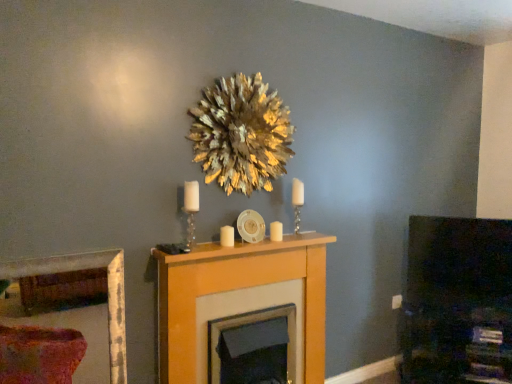
Measure the distance between point (248, 356) and camera.

The distance of point (248, 356) from camera is 7.21 feet.

The image size is (512, 384). Find the location of `wooden picture frame at lower left`. wooden picture frame at lower left is located at coordinates (75, 306).

Describe the element at coordinates (75, 306) in the screenshot. I see `wooden picture frame at lower left` at that location.

You are a GUI agent. You are given a task and a screenshot of the screen. Output one action in this format:
    pyautogui.click(x=<x>, y=<y>)
    Task: Click on the clear glass candle holder at center, acting as the second candle holder starting from the left
    
    Given the screenshot: What is the action you would take?
    pyautogui.click(x=297, y=202)

I want to click on gold leafy wreath at upper center, so click(241, 134).

From a real-world perspective, between white matte candle at center, the first candle in the left-to-right sequence, and clear glass candle holder at center, the 1th candle holder from the right, who is vertically higher?

clear glass candle holder at center, the 1th candle holder from the right, is physically above.

Who is shorter, white matte candle at center, the first candle in the left-to-right sequence, or clear glass candle holder at center, which is counted as the 2th candle holder, starting from the front?

With less height is white matte candle at center, the first candle in the left-to-right sequence.

Does white matte candle at center, the first candle from the front, lie in front of clear glass candle holder at center, which is counted as the 2th candle holder, starting from the front?

Yes, white matte candle at center, the first candle from the front, is closer to the camera.

Which of these two, white matte candle at center, the first candle from the front, or clear glass candle holder at center, acting as the second candle holder starting from the left, is bigger?

clear glass candle holder at center, acting as the second candle holder starting from the left, is bigger.

Can you tell me how much wooden mantel at center and wooden picture frame at lower left differ in facing direction?

They differ by 0.236 degrees in their facing directions.

Find the location of a particular element. Image resolution: width=512 pixels, height=384 pixels. picture frame above the wooden mantel at center (from a real-world perspective) is located at coordinates (75, 306).

From the image's perspective, is wooden mantel at center positioned above or below wooden picture frame at lower left?

Based on their image positions, wooden mantel at center is located beneath wooden picture frame at lower left.

Is wooden mantel at center positioned with its back to gold leafy wreath at upper center?

No, gold leafy wreath at upper center is not at the back of wooden mantel at center.

From the image's perspective, is wooden mantel at center located above or below gold leafy wreath at upper center?

wooden mantel at center is below gold leafy wreath at upper center.

Between wooden mantel at center and gold leafy wreath at upper center, which one appears on the right side from the viewer's perspective?

From the viewer's perspective, wooden mantel at center appears more on the right side.

Considering the positions of points (231, 284) and (250, 120), is point (231, 284) farther from camera compared to point (250, 120)?

That is False.

Between wooden mantel at center and clear glass candle holder at center, the 2th candle holder when ordered from right to left, which one appears on the right side from the viewer's perspective?

Positioned to the right is wooden mantel at center.

Do you think wooden mantel at center is within clear glass candle holder at center, the 2th candle holder when ordered from right to left, or outside of it?

wooden mantel at center cannot be found inside clear glass candle holder at center, the 2th candle holder when ordered from right to left.

From their relative heights in the image, would you say wooden mantel at center is taller or shorter than clear glass candle holder at center, placed as the second candle holder when sorted from back to front?

Clearly, wooden mantel at center is taller compared to clear glass candle holder at center, placed as the second candle holder when sorted from back to front.

Considering the positions of objects clear glass candle holder at center, which appears as the 1th candle holder when viewed from the front, and textured fabric swivel chair at lower left in the image provided, who is more to the left, clear glass candle holder at center, which appears as the 1th candle holder when viewed from the front, or textured fabric swivel chair at lower left?

Positioned to the left is textured fabric swivel chair at lower left.

Is clear glass candle holder at center, which appears as the 1th candle holder when viewed from the front, spatially inside textured fabric swivel chair at lower left, or outside of it?

The correct answer is: outside.

Would you say white matte candle at center, acting as the 2th candle starting from the right, is part of clear glass candle holder at center, marked as the 1th candle holder in a left-to-right arrangement,'s contents?

Definitely not — white matte candle at center, acting as the 2th candle starting from the right, is not inside clear glass candle holder at center, marked as the 1th candle holder in a left-to-right arrangement.

Between clear glass candle holder at center, the 2th candle holder when ordered from right to left, and white matte candle at center, which ranks as the 2th candle in back-to-front order, which one has more height?

With more height is clear glass candle holder at center, the 2th candle holder when ordered from right to left.

Which object is positioned more to the left, clear glass candle holder at center, marked as the 1th candle holder in a left-to-right arrangement, or white matte candle at center, the first candle from the front?

clear glass candle holder at center, marked as the 1th candle holder in a left-to-right arrangement.

From the image's perspective, relative to gold leafy wreath at upper center, is white glossy candle at center, which appears as the first candle when viewed from the right, above or below?

Based on their image positions, white glossy candle at center, which appears as the first candle when viewed from the right, is located beneath gold leafy wreath at upper center.

Which is more to the right, white glossy candle at center, the second candle when ordered from front to back, or gold leafy wreath at upper center?

Positioned to the right is white glossy candle at center, the second candle when ordered from front to back.

Considering the sizes of objects white glossy candle at center, the second candle when ordered from front to back, and gold leafy wreath at upper center in the image provided, who is shorter, white glossy candle at center, the second candle when ordered from front to back, or gold leafy wreath at upper center?

Standing shorter between the two is white glossy candle at center, the second candle when ordered from front to back.

Between white glossy candle at center, the second candle when ordered from front to back, and gold leafy wreath at upper center, which one has larger width?

gold leafy wreath at upper center.

Locate an element on the screen. The width and height of the screenshot is (512, 384). the 1st candle holder positioned above the white matte candle at center, the first candle in the left-to-right sequence (from a real-world perspective) is located at coordinates (297, 202).

Where is `picture frame that appears above the wooden mantel at center (from the image's perspective)`? The width and height of the screenshot is (512, 384). picture frame that appears above the wooden mantel at center (from the image's perspective) is located at coordinates (75, 306).

Estimate the real-world distances between objects in this image. Which object is further from clear glass candle holder at center, the 1th candle holder from the right, white glossy candle at center, which appears as the first candle when viewed from the right, or textured fabric swivel chair at lower left?

Based on the image, textured fabric swivel chair at lower left appears to be further to clear glass candle holder at center, the 1th candle holder from the right.

When comparing their distances from wooden picture frame at lower left, does matte black tv at right or clear glass candle holder at center, which is counted as the 2th candle holder, starting from the front, seem closer?

clear glass candle holder at center, which is counted as the 2th candle holder, starting from the front, is positioned closer to the anchor wooden picture frame at lower left.

Looking at the image, which one is located closer to clear glass candle holder at center, the 2th candle holder when ordered from right to left, textured fabric swivel chair at lower left or white glossy candle at center, acting as the second candle starting from the left?

Among the two, white glossy candle at center, acting as the second candle starting from the left, is located nearer to clear glass candle holder at center, the 2th candle holder when ordered from right to left.

From the image, which object appears to be farther from wooden picture frame at lower left, textured fabric swivel chair at lower left or white matte candle at center, acting as the 2th candle starting from the right?

The object further to wooden picture frame at lower left is white matte candle at center, acting as the 2th candle starting from the right.

When comparing their distances from white glossy candle at center, acting as the second candle starting from the left, does gold leafy wreath at upper center or textured fabric swivel chair at lower left seem further?

The object further to white glossy candle at center, acting as the second candle starting from the left, is textured fabric swivel chair at lower left.

When comparing their distances from wooden picture frame at lower left, does clear glass candle holder at center, which ranks as the first candle holder in back-to-front order, or matte black tv at right seem closer?

clear glass candle holder at center, which ranks as the first candle holder in back-to-front order, is positioned closer to the anchor wooden picture frame at lower left.

Considering their positions, is white matte candle at center, which ranks as the 2th candle in back-to-front order, positioned closer to gold leafy wreath at upper center than wooden picture frame at lower left?

Based on the image, white matte candle at center, which ranks as the 2th candle in back-to-front order, appears to be nearer to gold leafy wreath at upper center.

From the image, which object appears to be farther from white matte candle at center, the first candle from the front, white glossy candle at center, the 1th candle in the back-to-front sequence, or clear glass candle holder at center, acting as the second candle holder starting from the left?

Based on the image, clear glass candle holder at center, acting as the second candle holder starting from the left, appears to be further to white matte candle at center, the first candle from the front.

Find the location of `table between white matte candle at center, which ranks as the 2th candle in back-to-front order, and matte black tv at right, in the horizontal direction`. table between white matte candle at center, which ranks as the 2th candle in back-to-front order, and matte black tv at right, in the horizontal direction is located at coordinates (x=244, y=312).

At what (x,y) coordinates should I click in order to perform the action: click on candle holder between clear glass candle holder at center, which ranks as the first candle holder in back-to-front order, and wooden mantel at center vertically. Please return your answer as a coordinate pair (x, y). The image size is (512, 384). Looking at the image, I should click on (191, 209).

I want to click on flower between clear glass candle holder at center, placed as the second candle holder when sorted from back to front, and clear glass candle holder at center, which is counted as the 2th candle holder, starting from the front, so click(x=241, y=134).

Locate an element on the screen. The width and height of the screenshot is (512, 384). picture frame between gold leafy wreath at upper center and textured fabric swivel chair at lower left from top to bottom is located at coordinates (x=75, y=306).